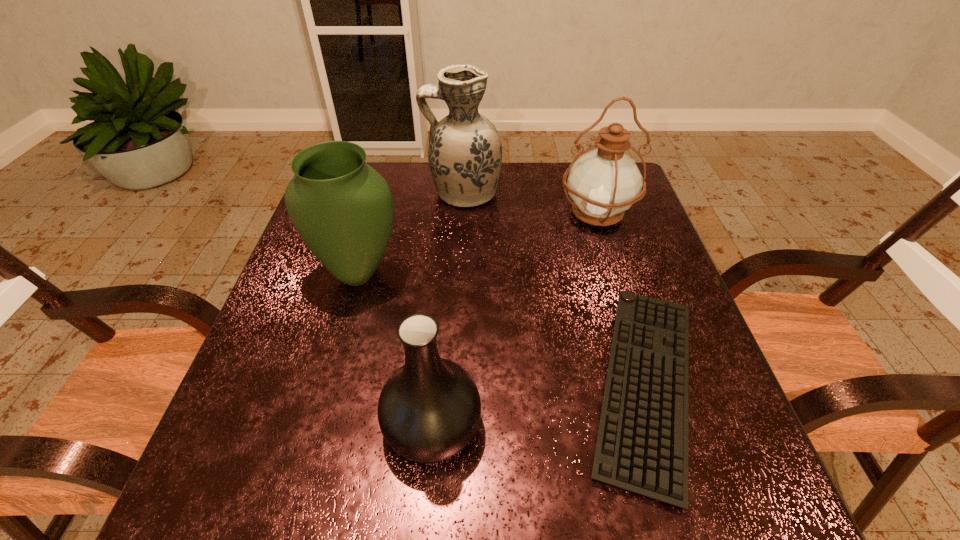
Identify the location of the farthest vase. (465, 152).

The image size is (960, 540). I want to click on oil lamp, so click(x=603, y=183).

Identify the location of the second nearest vase. (343, 209).

Identify the location of the leftmost object. This screenshot has height=540, width=960. pos(343,209).

Identify the location of the nearest vase. The height and width of the screenshot is (540, 960). (429, 409).

In order to click on computer keyboard in this screenshot , I will do `click(642, 444)`.

Identify the location of vacant space positioned 0.130m with the handle on the side of the farthest vase. (380, 193).

Locate an element on the screen. The height and width of the screenshot is (540, 960). vacant space located with the handle on the side of the farthest vase is located at coordinates (384, 193).

This screenshot has height=540, width=960. I want to click on free space located with the handle on the side of the farthest vase, so click(x=343, y=193).

I want to click on free space located 0.140m on the front of the oil lamp, so click(616, 278).